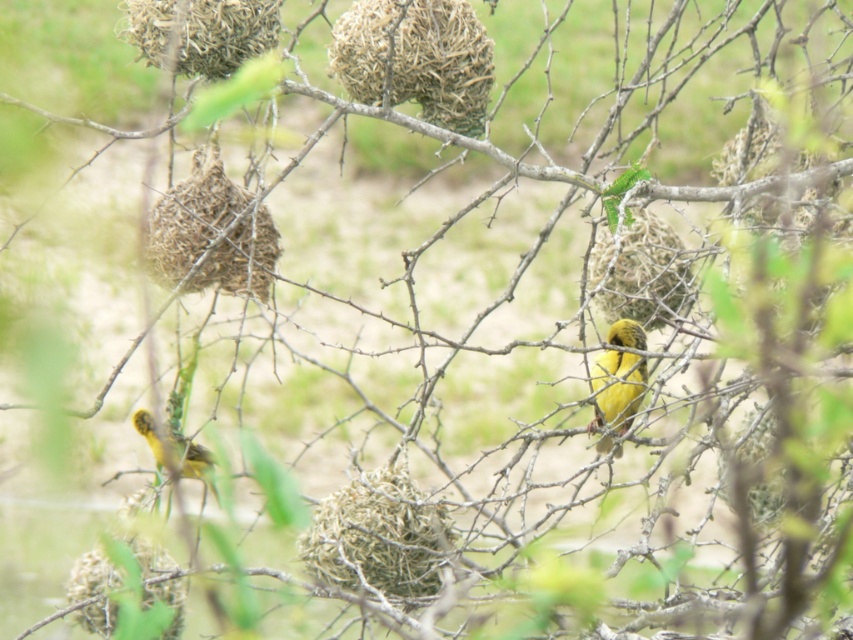
Can you confirm if brown textured nest at upper center is positioned above brown woven nest at upper left?

Indeed, brown textured nest at upper center is positioned over brown woven nest at upper left.

Measure the distance between brown textured nest at upper center and camera.

A distance of 12.82 feet exists between brown textured nest at upper center and camera.

Describe the element at coordinates (416, 58) in the screenshot. I see `brown textured nest at upper center` at that location.

The image size is (853, 640). Find the location of `brown textured nest at upper center`. brown textured nest at upper center is located at coordinates [416, 58].

Is brown textured nest at upper center positioned behind green textured nest at center?

Yes, brown textured nest at upper center is further from the viewer.

Looking at this image, can you confirm if brown textured nest at upper center is positioned to the left of green textured nest at center?

No, brown textured nest at upper center is not to the left of green textured nest at center.

Locate an element on the screen. This screenshot has height=640, width=853. brown textured nest at upper center is located at coordinates (416, 58).

Can you confirm if yellow matte bird at center is shorter than yellow matte bird at left?

No.

Is point (618, 355) farther from camera compared to point (144, 410)?

No, it is not.

In order to click on yellow matte bird at center in this screenshot , I will do `click(618, 388)`.